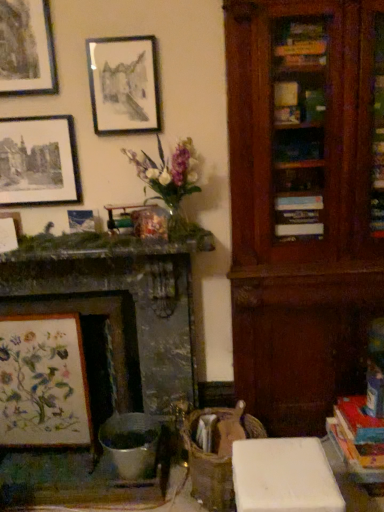
Question: Based on their sizes in the image, would you say wooden swivel chair at center is bigger or smaller than marble fireplace at left?

Choices:
 (A) big
 (B) small

Answer: (B)

Question: From the image's perspective, is wooden swivel chair at center positioned above or below marble fireplace at left?

Choices:
 (A) above
 (B) below

Answer: (B)

Question: Which of these objects is positioned closest to the embroidered fabric at left, the sixth picture frame viewed from the top?

Choices:
 (A) metallic silver picture frame at upper left, the fourth picture frame viewed from the top
 (B) wooden swivel chair at center
 (C) marble fireplace at left
 (D) matte black picture frame at upper left, the 4th picture frame in the bottom-to-top sequence
 (E) matte white picture frame at upper left, which is the fifth picture frame in top-to-bottom order

Answer: (C)

Question: Which is nearer to the marble fireplace at left?

Choices:
 (A) embroidered fabric at left, the sixth picture frame viewed from the top
 (B) matte black picture frame at upper left, marked as the first picture frame in a top-to-bottom arrangement
 (C) matte white picture frame at upper left, which is the second picture frame in bottom-to-top order
 (D) metallic silver picture frame at upper left, the third picture frame ordered from the bottom
 (E) wooden swivel chair at center

Answer: (A)